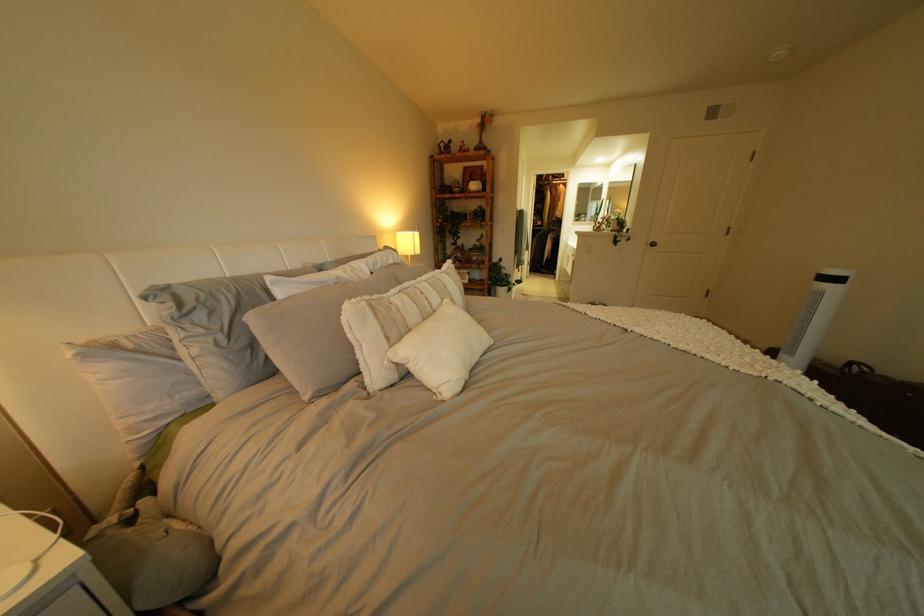
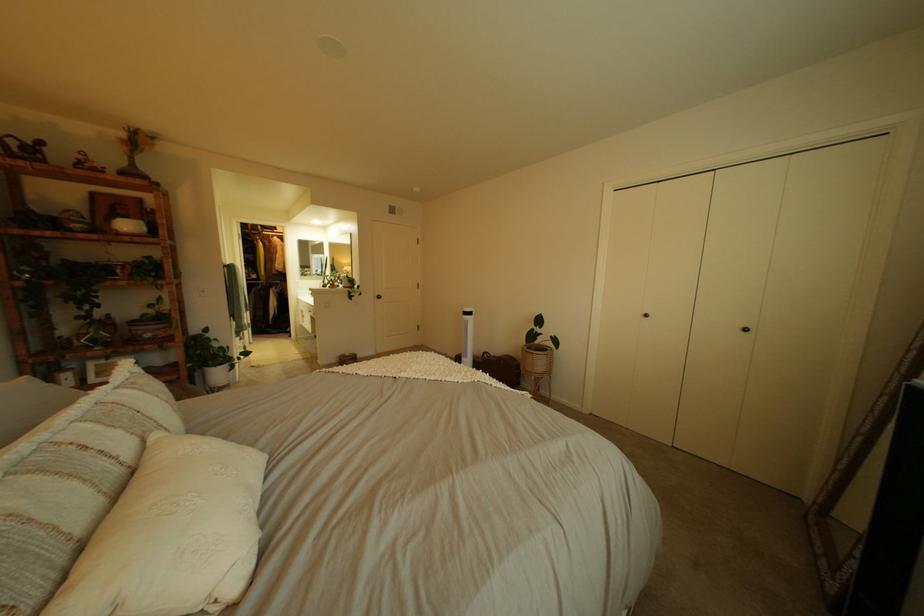
Locate, in the second image, the point that corresponds to [451,294] in the first image.

(134, 434)